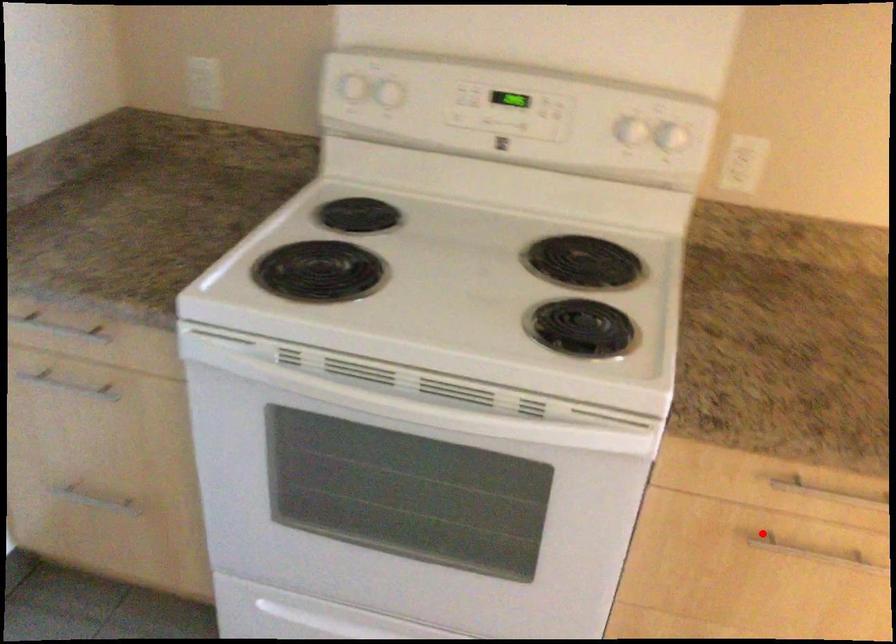
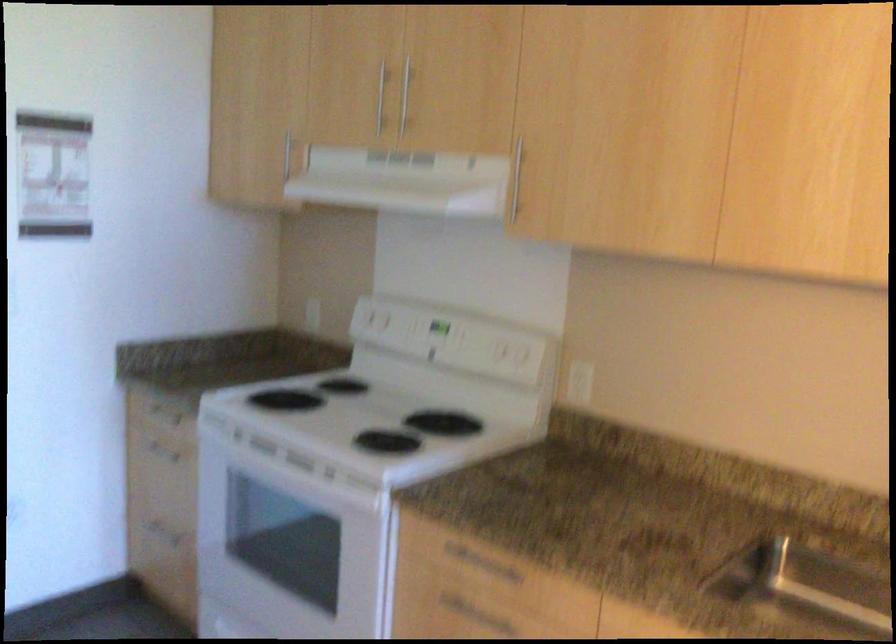
Where in the second image is the point corresponding to the highlighted location from the first image?

(466, 609)